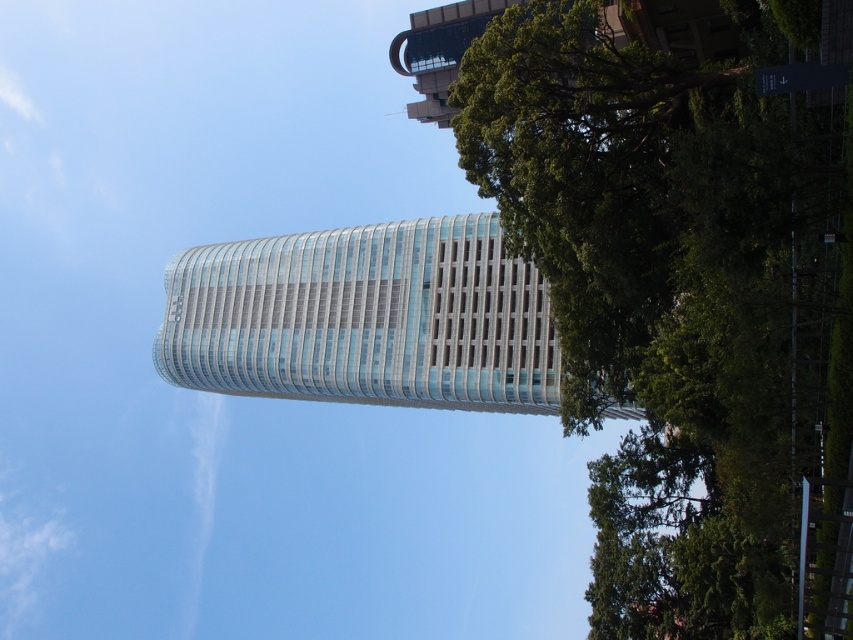
You are a photographer aiming to capture the glassy silver tower at center without any obstructions. From your current position, you notice the green leafy tree at upper right. What should you do to ensure the tower is fully visible?

Move your position to the left so the green leafy tree at upper right is no longer blocking the view of the glassy silver tower at center.

You are a drone operator trying to capture a clear photo of the skyscraper. Your drone is currently at the position of the green leafy tree at upper right. To avoid obstructing the view of the skyscraper, should you move the drone upwards or downwards?

The green leafy tree at upper right is positioned at point 0.467 on the x axis and 0.801 on the y axis. Since the skyscraper is in the background and the trees are in the foreground, moving the drone upwards would increase the distance from the foreground trees and allow a clearer view of the skyscraper. Alternatively, moving the drone downwards might bring it closer to the trees, potentially causing more obstruction. Therefore, moving upwards is the better choice.